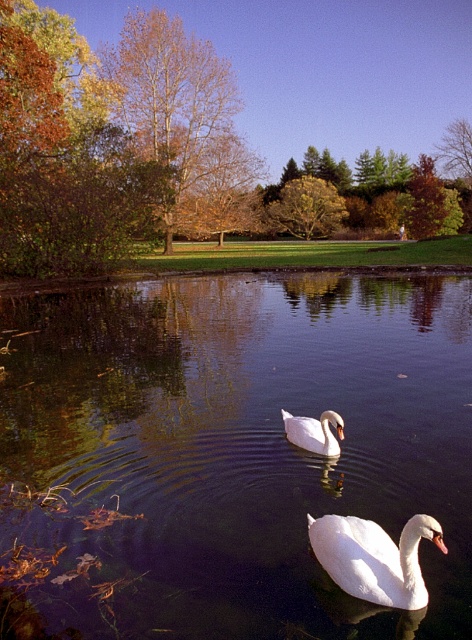
Consider the image. You are standing at the edge of the pond and want to take a photo of the white glossy swan at lower center. However, there is transparent water at center in the way. Can you adjust your position so that the swan is visible without the water blocking it?

The white glossy swan at lower center is behind the transparent water at center, so adjusting your position might not fully eliminate the water from the view. However, since the water is transparent, you can still see the swan through it. Alternatively, moving slightly to the side or angle your camera to focus on the swan while minimizing the water in the frame could help achieve a clearer view of the swan.

Looking at this image, you are standing at the edge of the pond and want to throw a pebble to hit both point [396,435] and point [389,560] in the water. Which point should you aim for first to hit them in order from closest to farthest from you?

You should aim for point [389,560] first because it is closer to you than point [396,435], which is further away.